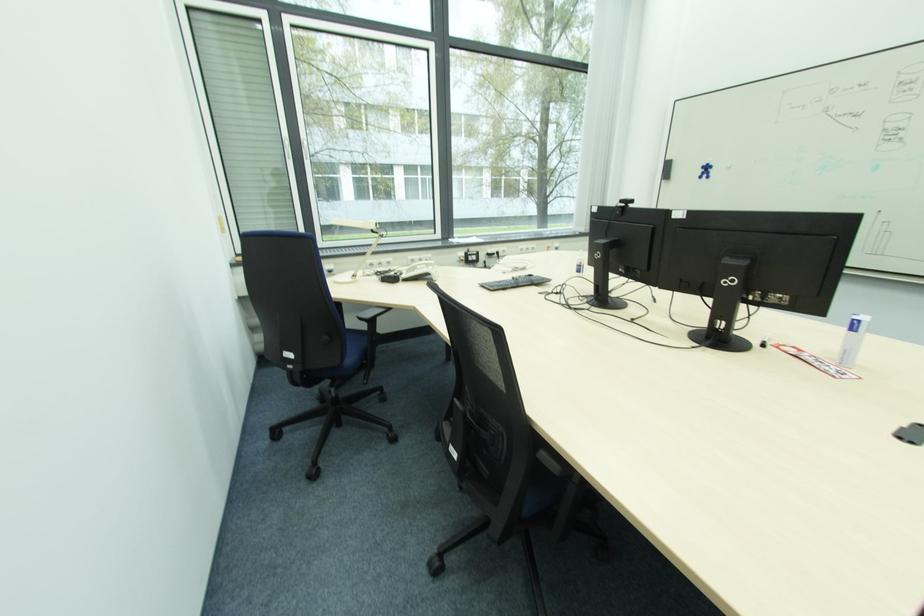
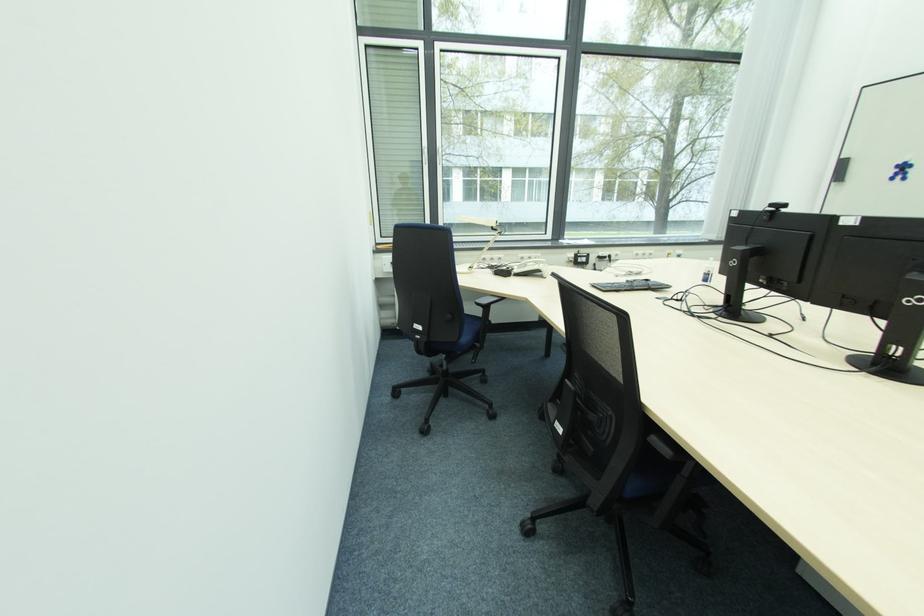
Where in the second image is the point corresponding to (x=585, y=265) from the first image?

(712, 274)